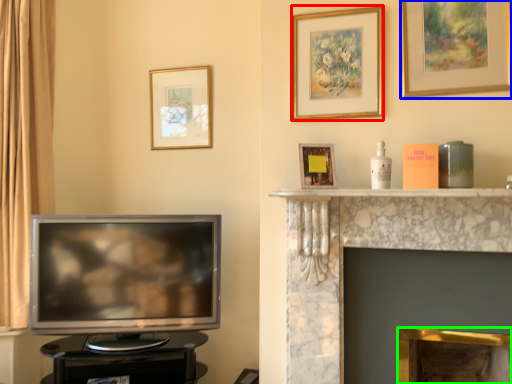
Question: Which object is positioned farthest from picture frame (highlighted by a red box)? Select from picture frame (highlighted by a blue box) and fireplace (highlighted by a green box).

Choices:
 (A) picture frame
 (B) fireplace

Answer: (B)